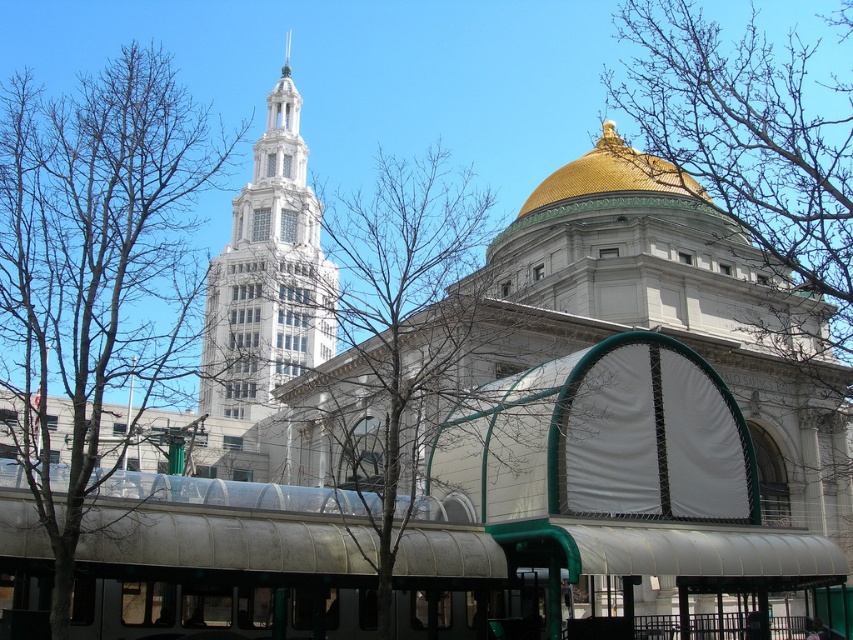
This screenshot has height=640, width=853. What do you see at coordinates (97, 262) in the screenshot?
I see `brown leafless tree at left` at bounding box center [97, 262].

Find the location of a particular element. brown leafless tree at left is located at coordinates (97, 262).

Is point (99, 108) behind point (625, 163)?

No.

Locate an element on the screen. This screenshot has height=640, width=853. brown leafless tree at left is located at coordinates (97, 262).

Is point (566, 381) less distant than point (804, 81)?

Yes, point (566, 381) is closer to viewer.

Who is more forward, (688, 356) or (807, 141)?

Point (688, 356) is in front.

This screenshot has width=853, height=640. Find the location of `white fabric awning at center`. white fabric awning at center is located at coordinates (624, 472).

Is point (795, 161) farther from camera compared to point (676, 189)?

No.

The height and width of the screenshot is (640, 853). I want to click on bare branches at upper right, so click(749, 141).